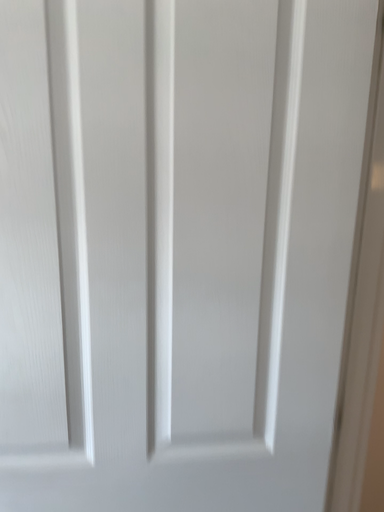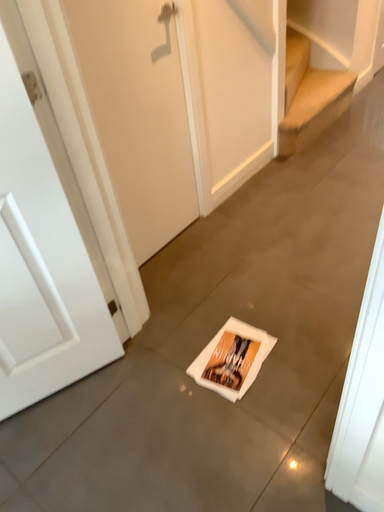
Question: Which way did the camera rotate in the video?

Choices:
 (A) rotated left
 (B) rotated right

Answer: (B)